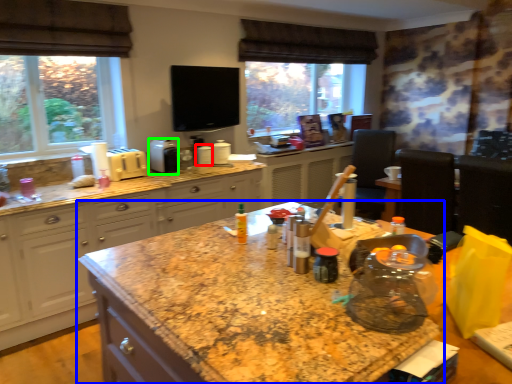
Question: Which object is the farthest from appliance (highlighted by a red box)? Choose among these: countertop (highlighted by a blue box) or appliance (highlighted by a green box).

Choices:
 (A) countertop
 (B) appliance

Answer: (A)